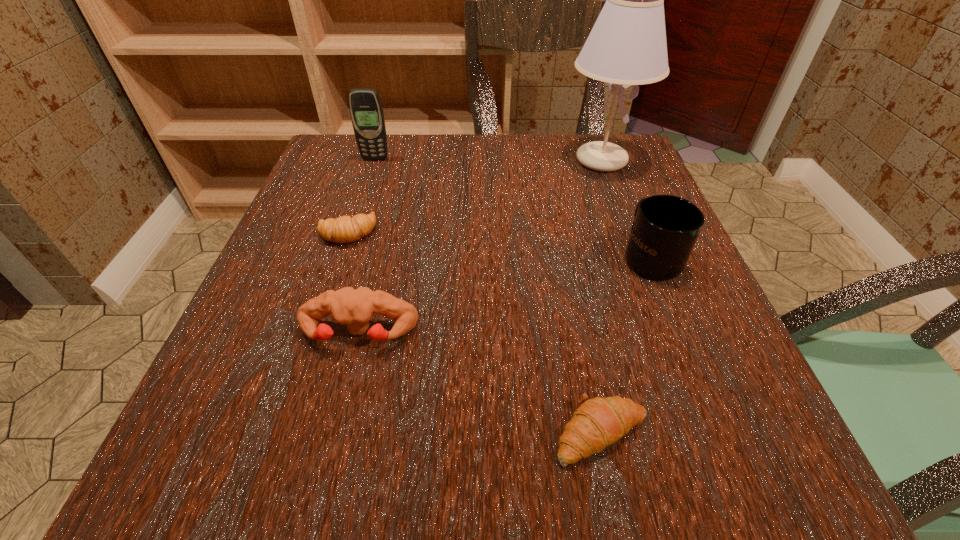
Find the location of `free space between the mug and the second tallest object`. free space between the mug and the second tallest object is located at coordinates (513, 207).

You are a GUI agent. You are given a task and a screenshot of the screen. Output one action in this format:
    pyautogui.click(x=<x>, y=<y>)
    Task: Click on the vacant area that lies between the second nearest object and the fifth shortest object
    This screenshot has height=540, width=960.
    Given the screenshot: What is the action you would take?
    pyautogui.click(x=367, y=246)

At what (x,y) coordinates should I click in order to perform the action: click on unoccupied position between the nearest object and the left crescent roll. Please return your answer as a coordinate pair (x, y). The image size is (960, 540). Looking at the image, I should click on (474, 333).

Identify the location of vacant area that lies between the nearest object and the fourth shortest object. This screenshot has width=960, height=540. (626, 345).

Locate an element on the screen. This screenshot has width=960, height=540. object that is the second closest to the fifth shortest object is located at coordinates (627, 45).

Locate which object ranks second in proximity to the second tallest object. Please provide its 2D coordinates. Your answer should be formatted as a tuple, i.e. [(x, y)], where the tuple contains the x and y coordinates of a point satisfying the conditions above.

[(627, 45)]

The width and height of the screenshot is (960, 540). Identify the location of vacant space that satisfies the following two spatial constraints: 1. with the gloves of the fifth farthest object facing forward; 2. on the left side of the nearer crescent roll. (334, 433).